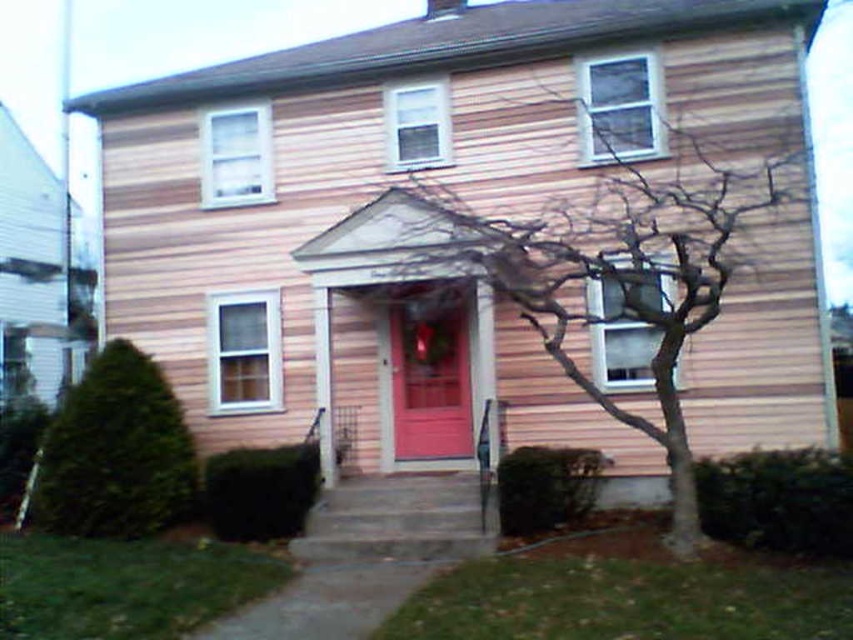
Can you confirm if bare branches at center is wider than matte wood door at center?

Yes, bare branches at center is wider than matte wood door at center.

Who is shorter, bare branches at center or matte wood door at center?

With less height is matte wood door at center.

The width and height of the screenshot is (853, 640). In order to click on bare branches at center in this screenshot , I will do `click(614, 266)`.

Which of these two, bare branches at center or green leafy bush at lower left, stands taller?

With more height is bare branches at center.

At what (x,y) coordinates should I click in order to perform the action: click on bare branches at center. Please return your answer as a coordinate pair (x, y). Looking at the image, I should click on (614, 266).

Is green leafy bush at lower left shorter than matte wood door at center?

No.

Is green leafy bush at lower left above matte wood door at center?

Incorrect, green leafy bush at lower left is not positioned above matte wood door at center.

Who is more forward, (119, 508) or (439, 358)?

Point (119, 508)

At what (x,y) coordinates should I click in order to perform the action: click on green leafy bush at lower left. Please return your answer as a coordinate pair (x, y). The image size is (853, 640). Looking at the image, I should click on (115, 452).